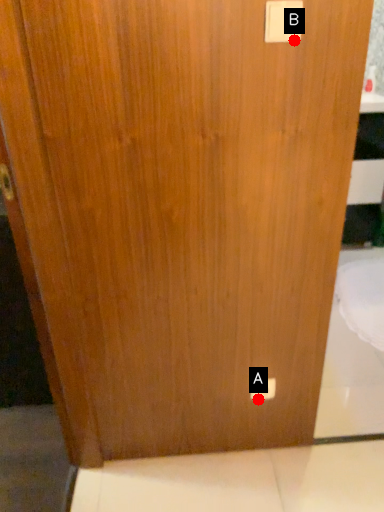
Question: Two points are circled on the image, labeled by A and B beside each circle. Which point is closer to the camera taking this photo?

Choices:
 (A) A is closer
 (B) B is closer

Answer: (B)